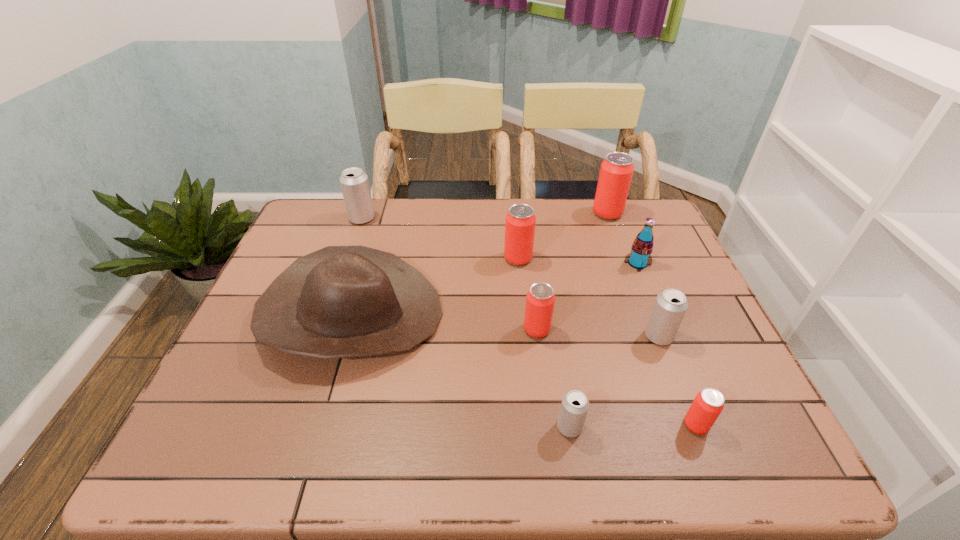
Identify the location of empty location between the nearest red beer can and the second biggest white beer can. This screenshot has height=540, width=960. (677, 381).

Where is `free space between the leftmost beer can and the nearest white beer can`? Image resolution: width=960 pixels, height=540 pixels. free space between the leftmost beer can and the nearest white beer can is located at coordinates (466, 323).

I want to click on free space between the soda and the second nearest red beer can, so click(x=588, y=296).

The height and width of the screenshot is (540, 960). What are the coordinates of `object that is the seventh nearest to the soda` in the screenshot? It's located at pyautogui.click(x=340, y=301).

Identify which object is the fourth nearest to the third farthest red beer can. Please provide its 2D coordinates. Your answer should be formatted as a tuple, i.e. [(x, y)], where the tuple contains the x and y coordinates of a point satisfying the conditions above.

[(670, 306)]

This screenshot has width=960, height=540. I want to click on beer can that is the seventh closest one to the soda, so click(354, 183).

Locate an element on the screen. This screenshot has height=540, width=960. beer can that is the fifth closest to the fifth nearest beer can is located at coordinates (574, 407).

You are a GUI agent. You are given a task and a screenshot of the screen. Output one action in this format:
    pyautogui.click(x=<x>, y=<y>)
    Task: Click on the second closest red beer can to the second smallest red beer can
    This screenshot has height=540, width=960.
    Given the screenshot: What is the action you would take?
    pyautogui.click(x=708, y=404)

Choose which red beer can is the fourth nearest neighbor to the second farthest white beer can. Please provide its 2D coordinates. Your answer should be formatted as a tuple, i.e. [(x, y)], where the tuple contains the x and y coordinates of a point satisfying the conditions above.

[(616, 171)]

The width and height of the screenshot is (960, 540). Identify the location of white beer can that is the second closest to the second nearest red beer can. (670, 306).